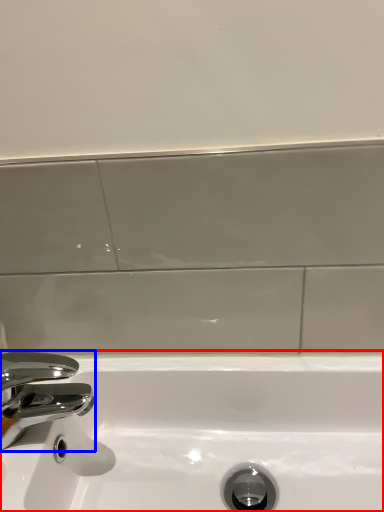
Question: Which object appears closest to the camera in this image, sink (highlighted by a red box) or tap (highlighted by a blue box)?

Choices:
 (A) sink
 (B) tap

Answer: (A)